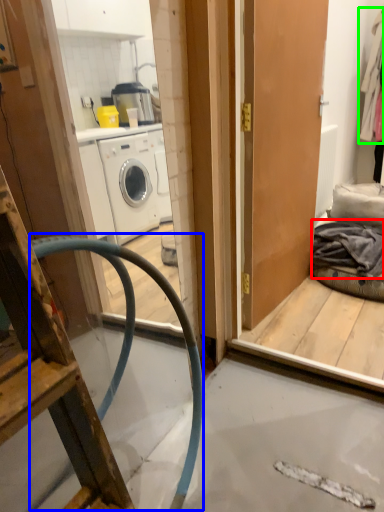
Question: Which is nearer to the clothing (highlighted by a red box)? garden hose (highlighted by a blue box) or clothing (highlighted by a green box).

Choices:
 (A) garden hose
 (B) clothing

Answer: (A)